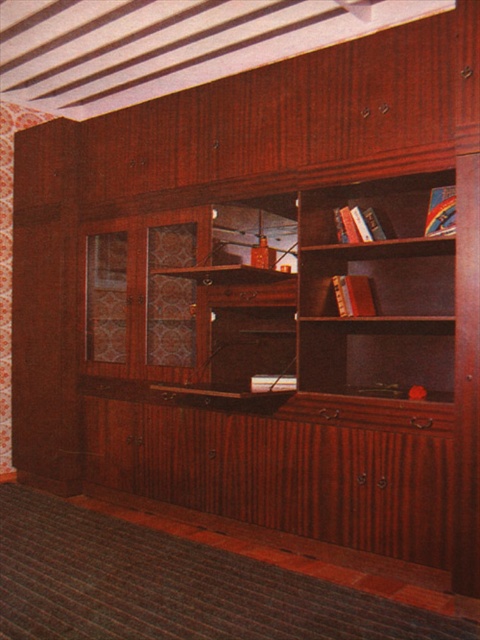
Looking at this image, you are standing in front of the entertainment unit and want to place a new book on one of the wooden bookshelves. Which bookshelf, the wooden bookshelf at center or the wooden bookshelf at upper right, is easier to reach without moving your position?

The wooden bookshelf at center is closer to the viewer than the wooden bookshelf at upper right, so it is easier to reach without moving your position.

From the picture: You are standing in the room and want to place a new painting on the wall. The painting is 1 meter wide. The wooden bookshelf at center is currently occupying space. Where should you place the painting so it doesn

The wooden bookshelf at center is located at point (376,292). To place the painting without overlapping the bookshelf, ensure the painting is positioned either to the left or right of the bookshelf, maintaining a clear space between them.

You are a delivery person who needs to place a 8 inch wide package between the wooden bookshelf at center and the wooden bookshelf at upper right. Can you fit it there?

The wooden bookshelf at center and wooden bookshelf at upper right are 7.82 inches apart from each other. Since the package is 8 inches wide, it cannot fit between them as the space is slightly narrower.